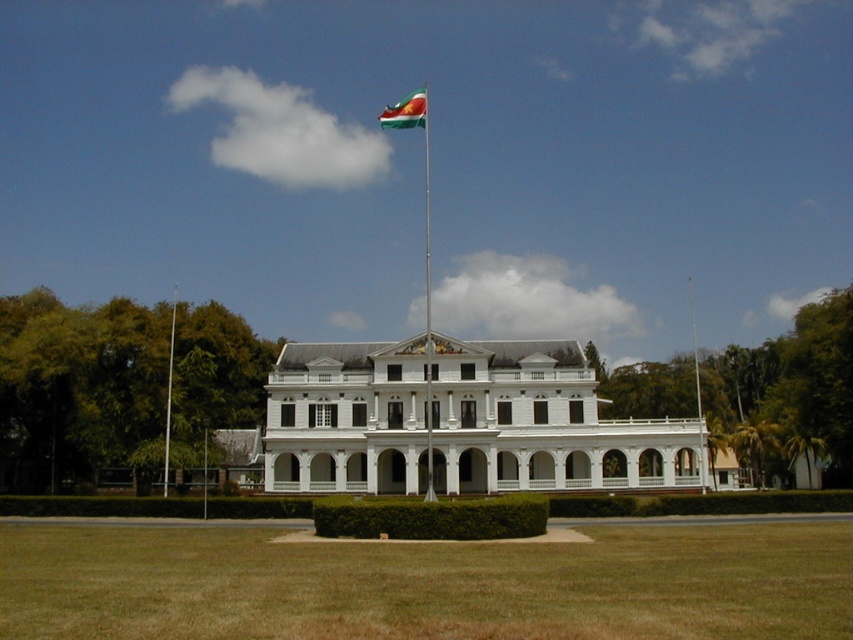
You are standing in the front yard of the property and want to walk to the entrance of the white glossy building at center. Which direction should you walk relative to the green grass at lower center?

You should walk towards the white glossy building at center, which is behind the green grass at lower center. Since the green grass at lower center is closer to the viewer than the white glossy building at center, you need to move backward away from the green grass at lower center to reach the entrance.

You are standing at the entrance of the grand white colonial building and want to locate the polished plastic flag at upper center. Based on the coordinates provided, can you determine its position relative to the building?

The polished plastic flag at upper center is located at coordinates point [405,112], which places it slightly to the left of the building and above the center point.